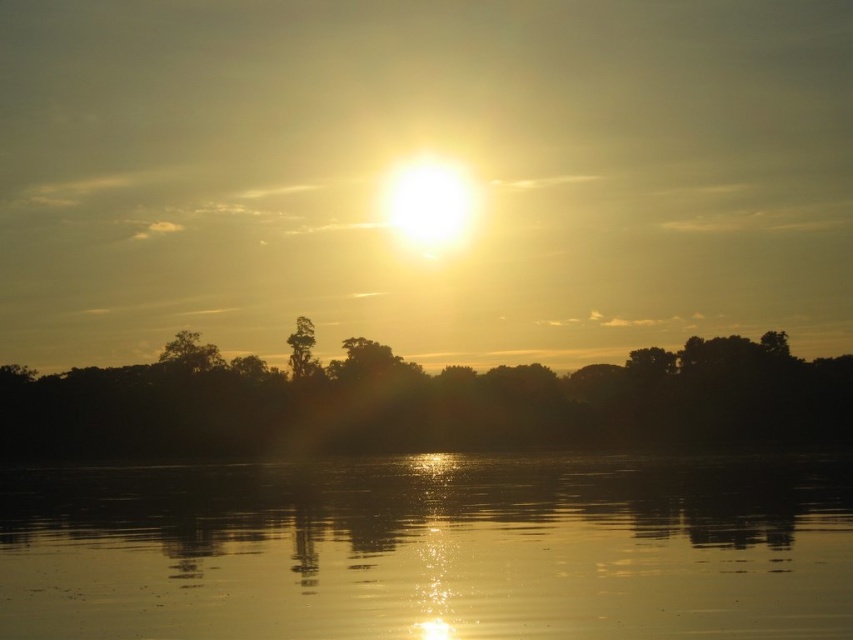
Between golden reflective water at center and green matte tree at center, which one is positioned higher?

green matte tree at center is higher up.

What do you see at coordinates (431, 548) in the screenshot? The height and width of the screenshot is (640, 853). I see `golden reflective water at center` at bounding box center [431, 548].

Does point (138, 499) lie in front of point (294, 321)?

Yes.

Where is `golden reflective water at center`? Image resolution: width=853 pixels, height=640 pixels. golden reflective water at center is located at coordinates (431, 548).

Measure the distance between point [167,346] and camera.

Point [167,346] is 607.76 feet away from camera.

Does green matte tree at left have a smaller size compared to green matte tree at center?

No, green matte tree at left is not smaller than green matte tree at center.

Is point (177, 332) positioned after point (310, 330)?

No, (177, 332) is in front of (310, 330).

Identify the location of green matte tree at left. (189, 353).

Who is more forward, (585,609) or (42,394)?

Point (585,609)

Consider the image. Which is above, golden reflective water at center or silhouette tree at center?

Positioned higher is silhouette tree at center.

Locate an element on the screen. Image resolution: width=853 pixels, height=640 pixels. golden reflective water at center is located at coordinates (431, 548).

Where is `golden reflective water at center`? golden reflective water at center is located at coordinates (431, 548).